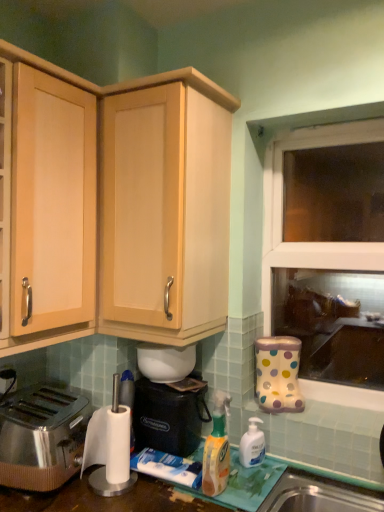
Where is `blank space situated above black plastic trash can at lower center, the 2th appliance positioned from the top (from a real-world perspective)`? Image resolution: width=384 pixels, height=512 pixels. blank space situated above black plastic trash can at lower center, the 2th appliance positioned from the top (from a real-world perspective) is located at coordinates (181, 380).